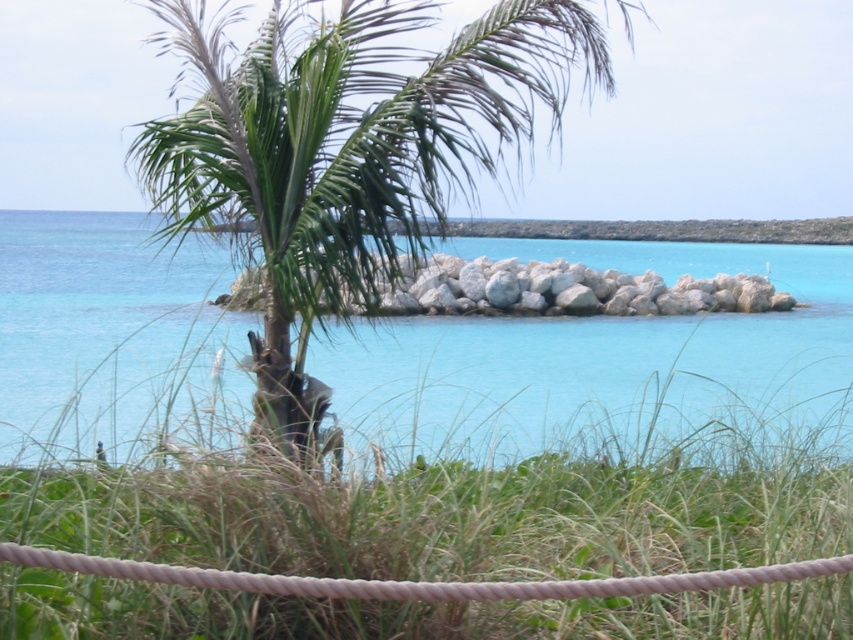
Based on the photo, you are standing on the rocky outcrop and want to walk to the green grass at center. Which direction should you move to reach it from the turquoise water at center?

The green grass at center is located below the turquoise water at center, so you should move downward to reach the green grass at center from the turquoise water at center.